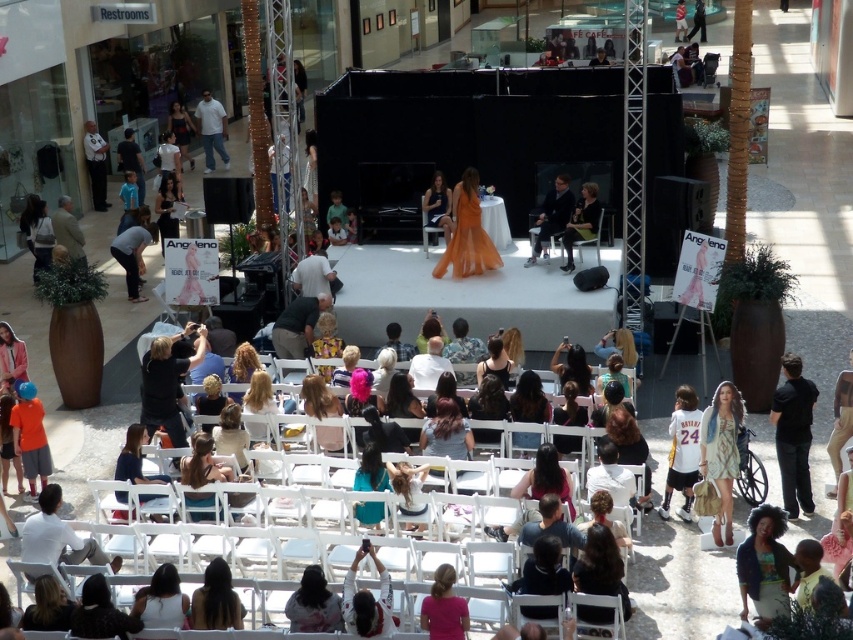
You are attending an event in the mall and need to retrieve an item from the stage where the black leather jacket at center and matte black dress at center are located. Which item is closer to you if you are facing the stage?

The black leather jacket at center is closer to you because the matte black dress at center is behind it.

Looking at this image, you are standing at the center of the stage in the shopping mall atrium. You want to place a matte black jacket at lower right on the stage. Is the location available for placing the jacket?

Yes, the location for placing the matte black jacket at lower right is available at point coordinates (764,564) on the stage.